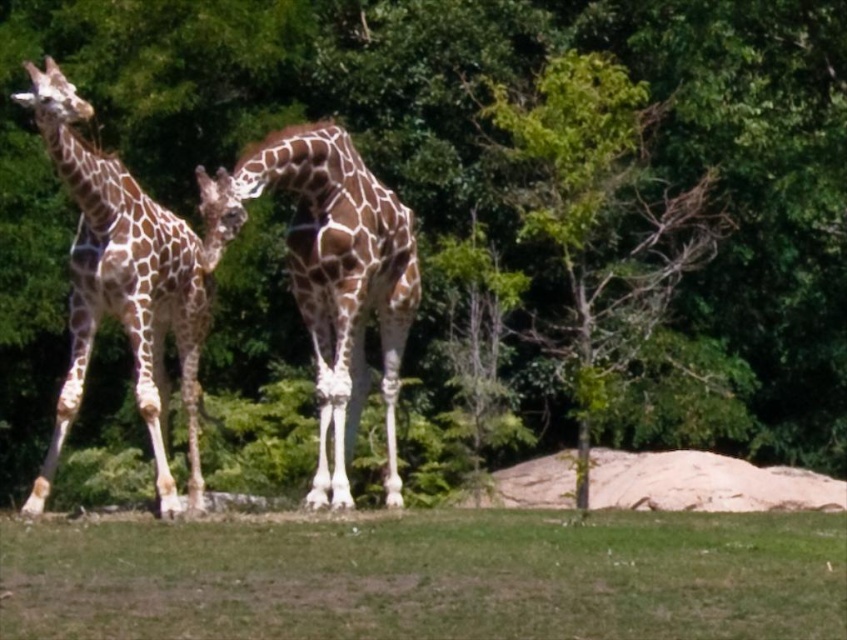
You are a small bird flying above the scene. You want to land on the green grass at lower center. Will you be able to see the spotted giraffe at left from the grass?

The green grass at lower center is shorter than the spotted giraffe at left, so yes, you will be able to see the spotted giraffe at left from the grass because the giraffe is taller than the grass.

You are a visitor at the zoo and see the green leafy tree at center and the brown spotted giraffe at center. Which one is positioned more to the right side of the scene?

The green leafy tree at center is positioned more to the right side of the scene because it is to the right of the brown spotted giraffe at center.

You are a zookeeper standing on the green grass at lower center and want to feed the brown spotted giraffe at center. Can you reach the giraffe with a 10 feet long feeding stick?

The green grass at lower center is 8.96 feet away from brown spotted giraffe at center. Since the feeding stick is 10 feet long, which is longer than the distance between you and the giraffe, you can reach the giraffe.